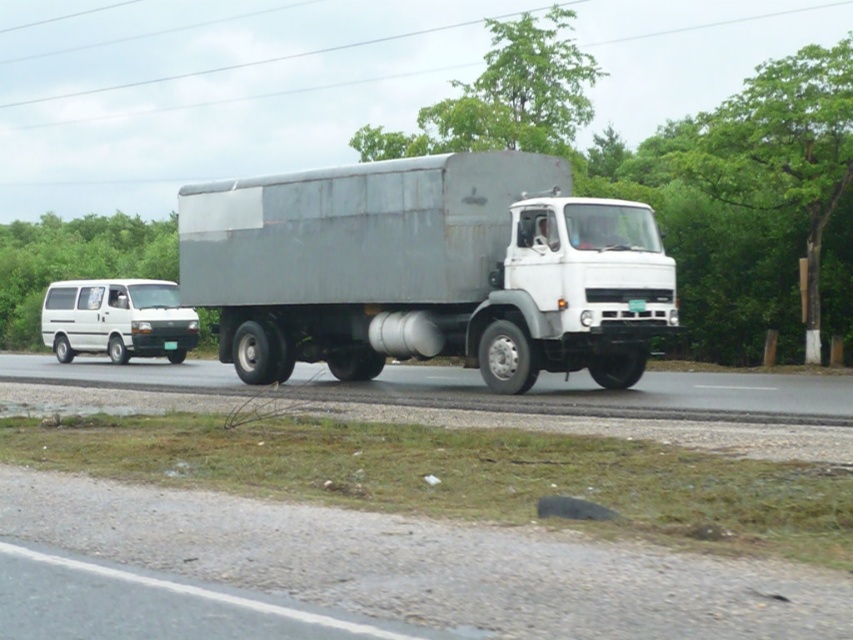
Question: Which point appears closest to the camera in this image?

Choices:
 (A) (518, 234)
 (B) (41, 380)
 (C) (160, 314)

Answer: (A)

Question: Does gray matte trailer truck at center appear on the left side of smooth asphalt road at center?

Choices:
 (A) no
 (B) yes

Answer: (A)

Question: Which point is closer to the camera?

Choices:
 (A) smooth asphalt road at center
 (B) gray matte trailer truck at center

Answer: (A)

Question: Where is gray matte trailer truck at center located in relation to white matte van at left in the image?

Choices:
 (A) left
 (B) right

Answer: (B)

Question: Can you confirm if smooth asphalt road at center is positioned above white matte van at left?

Choices:
 (A) yes
 (B) no

Answer: (B)

Question: Among these points, which one is nearest to the camera?

Choices:
 (A) (142, 362)
 (B) (352, 189)
 (C) (157, 337)

Answer: (B)